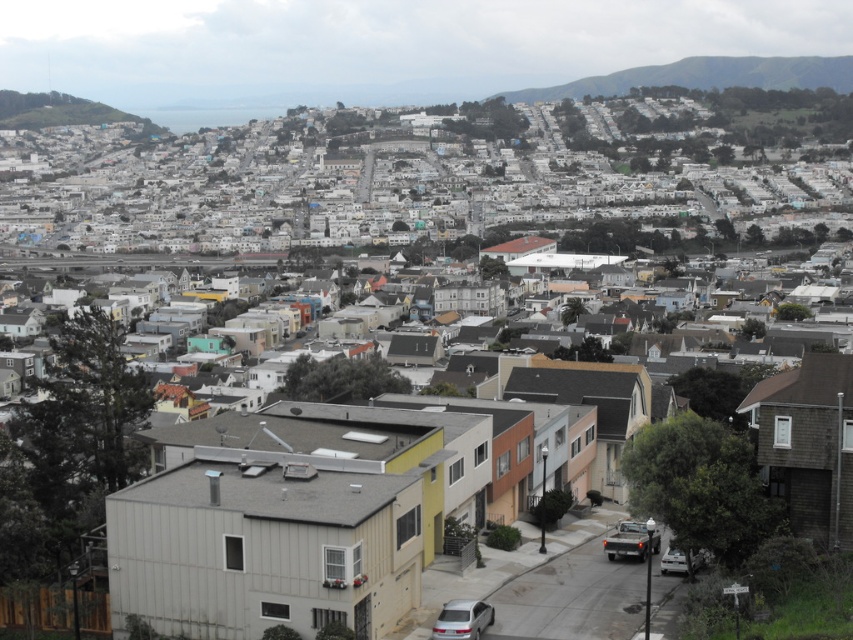
From the picture: You are a delivery driver trying to navigate through the narrow streets of this hilly neighborhood. You see a shiny silver car at lower center and a silver metallic car at lower right. Which car should you avoid if you need to pass through the tightest part of the street?

You should avoid the shiny silver car at lower center because it is larger in size than the silver metallic car at lower right, making it harder to maneuver through tight spaces.

You are standing at the intersection of the street and want to take a photo of both the green grassy hillside at upper left and the silver metallic car at lower right. Which direction should you face to ensure both are visible in your camera frame?

You should face towards the center of the image so that both the green grassy hillside at upper left and the silver metallic car at lower right are within your camera frame, as the hillside is positioned to the left of the car.